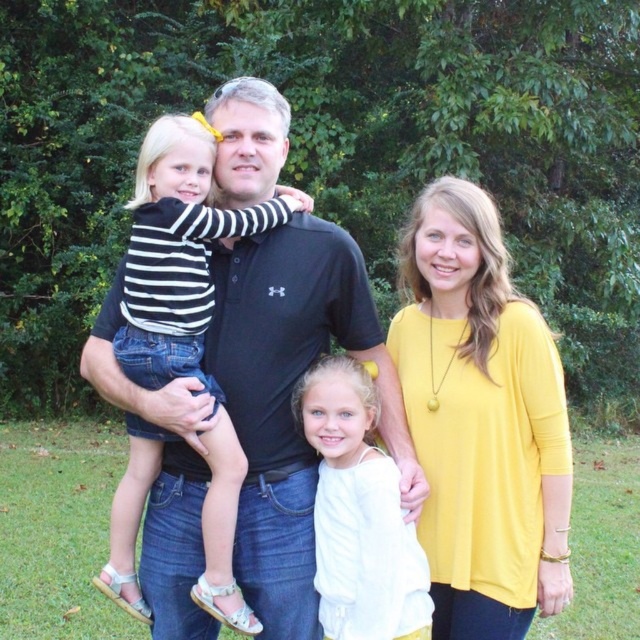
Does black polo shirt at center appear over yellow matte top at center?

Yes, black polo shirt at center is above yellow matte top at center.

Measure the distance from black polo shirt at center to yellow matte top at center.

They are 23.11 inches apart.

Which is in front, point (243, 492) or point (426, 308)?

Point (243, 492)

The height and width of the screenshot is (640, 640). Identify the location of black polo shirt at center. (289, 397).

Can you confirm if yellow matte top at center is positioned below white cotton shirt at center?

No, yellow matte top at center is not below white cotton shirt at center.

Which is behind, point (451, 412) or point (376, 538)?

The point (451, 412) is more distant.

Which is behind, point (552, 608) or point (321, 483)?

The point (321, 483) is behind.

Find the location of a particular element. yellow matte top at center is located at coordinates (481, 420).

Can you confirm if black polo shirt at center is bigger than white cotton shirt at center?

Correct, black polo shirt at center is larger in size than white cotton shirt at center.

Does point (257, 84) come in front of point (372, 392)?

That is False.

Find the location of a particular element. Image resolution: width=640 pixels, height=640 pixels. black polo shirt at center is located at coordinates (289, 397).

Find the location of a particular element. Image resolution: width=640 pixels, height=640 pixels. black polo shirt at center is located at coordinates (289, 397).